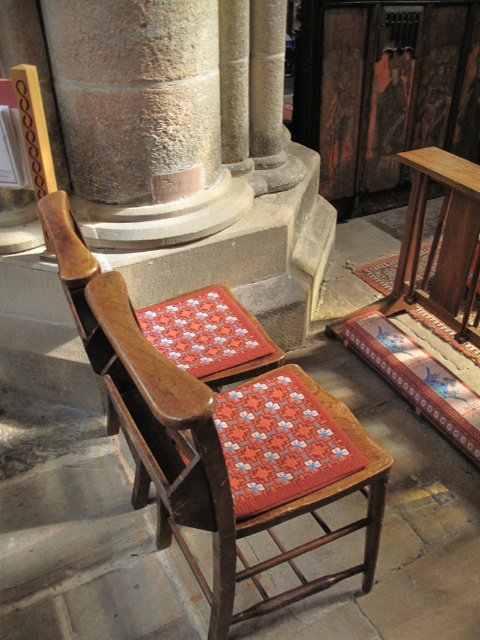
You are a decorator trying to arrange two cushions on a chair. You have a woven fabric cushion at center and a knitted woolen cushion at center. Which cushion should you place on the left side if you want the wider cushion to be on the right?

Since the woven fabric cushion at center is wider than the knitted woolen cushion at center, you should place the knitted woolen cushion at center on the left and the woven fabric cushion at center on the right to have the wider cushion on the right.

You are an interior designer planning to place a decorative item between the woven fabric cushion at center and the quilted orange fabric at center. Considering their sizes, which fabric should the decorative item be placed closer to?

The decorative item should be placed closer to the woven fabric cushion at center since it has a larger size compared to the quilted orange fabric at center, providing more space for placement.